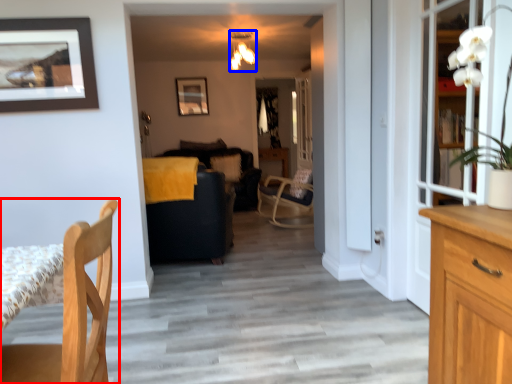
Question: Which object appears farthest to the camera in this image, chair (highlighted by a red box) or lamp (highlighted by a blue box)?

Choices:
 (A) chair
 (B) lamp

Answer: (B)